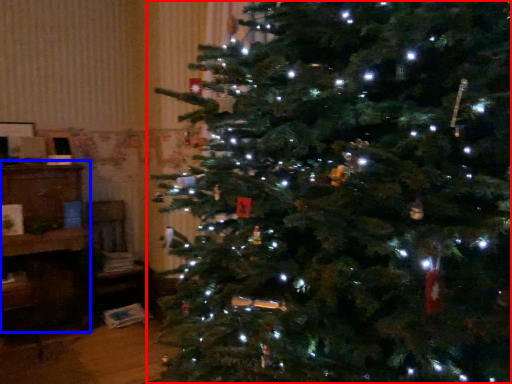
Question: Which object is closer to the camera taking this photo, christmas tree (highlighted by a red box) or furniture (highlighted by a blue box)?

Choices:
 (A) christmas tree
 (B) furniture

Answer: (B)